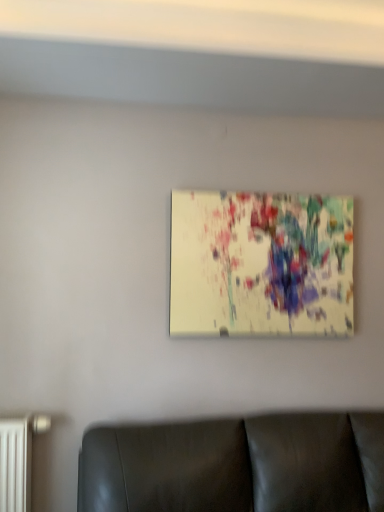
Question: Is black leather couch at lower center thinner than matte canvas painting at center?

Choices:
 (A) no
 (B) yes

Answer: (A)

Question: Is black leather couch at lower center in front of matte canvas painting at center?

Choices:
 (A) no
 (B) yes

Answer: (B)

Question: Could matte canvas painting at center be considered to be inside black leather couch at lower center?

Choices:
 (A) yes
 (B) no

Answer: (B)

Question: Is black leather couch at lower center oriented away from matte canvas painting at center?

Choices:
 (A) yes
 (B) no

Answer: (B)

Question: From the image's perspective, is black leather couch at lower center above matte canvas painting at center?

Choices:
 (A) yes
 (B) no

Answer: (B)

Question: From a real-world perspective, does black leather couch at lower center stand above matte canvas painting at center?

Choices:
 (A) yes
 (B) no

Answer: (B)

Question: Is matte canvas painting at center at the right side of black leather couch at lower center?

Choices:
 (A) yes
 (B) no

Answer: (A)

Question: Is matte canvas painting at center in contact with black leather couch at lower center?

Choices:
 (A) no
 (B) yes

Answer: (A)

Question: Could you tell me if matte canvas painting at center is facing black leather couch at lower center?

Choices:
 (A) yes
 (B) no

Answer: (B)

Question: Is matte canvas painting at center at the left side of black leather couch at lower center?

Choices:
 (A) no
 (B) yes

Answer: (A)

Question: Is matte canvas painting at center facing away from black leather couch at lower center?

Choices:
 (A) yes
 (B) no

Answer: (B)

Question: Is matte canvas painting at center positioned behind black leather couch at lower center?

Choices:
 (A) no
 (B) yes

Answer: (B)

Question: From a real-world perspective, relative to matte canvas painting at center, is black leather couch at lower center vertically above or below?

Choices:
 (A) below
 (B) above

Answer: (A)